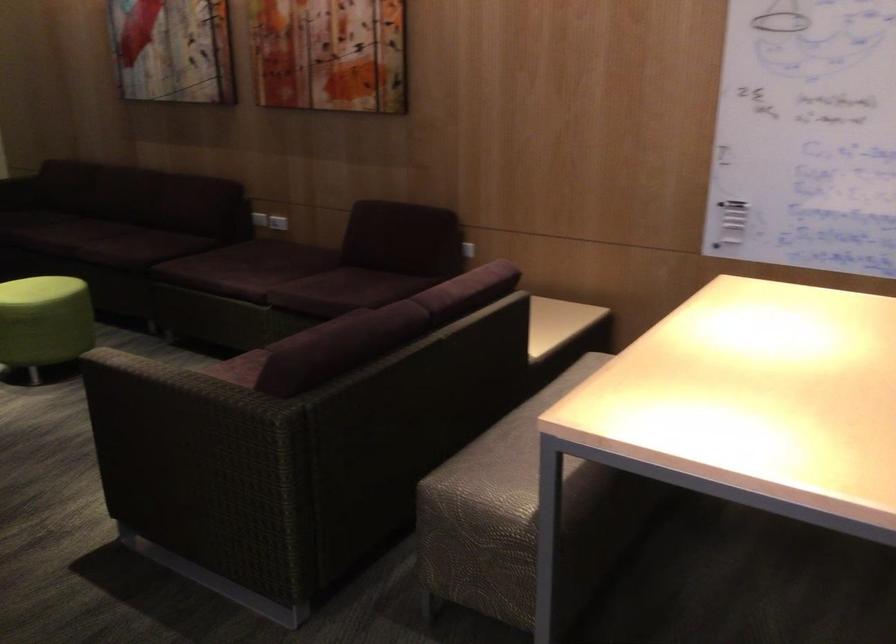
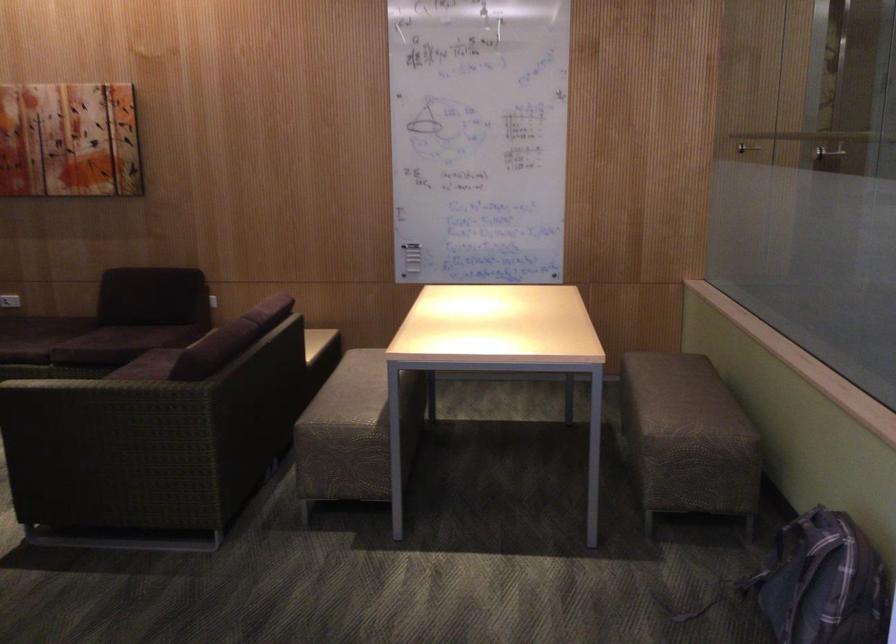
In the second image, find the point that corresponds to the point at 176,371 in the first image.

(96, 382)